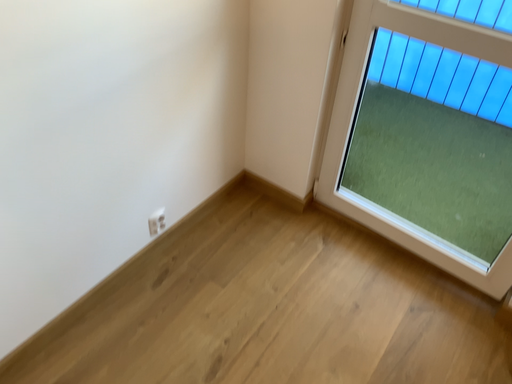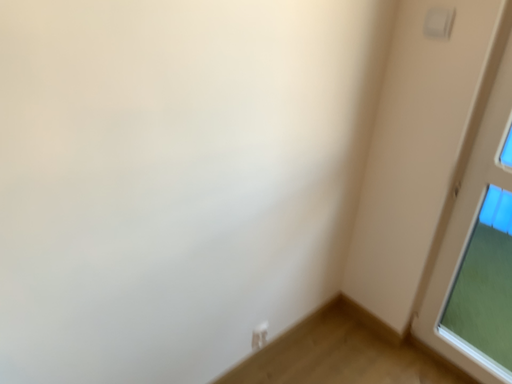
Question: How did the camera likely rotate when shooting the video?

Choices:
 (A) rotated downward
 (B) rotated upward

Answer: (B)